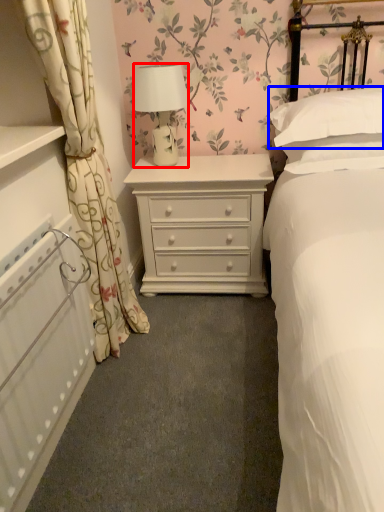
Question: Among these objects, which one is nearest to the camera, lamp (highlighted by a red box) or pillow (highlighted by a blue box)?

Choices:
 (A) lamp
 (B) pillow

Answer: (B)